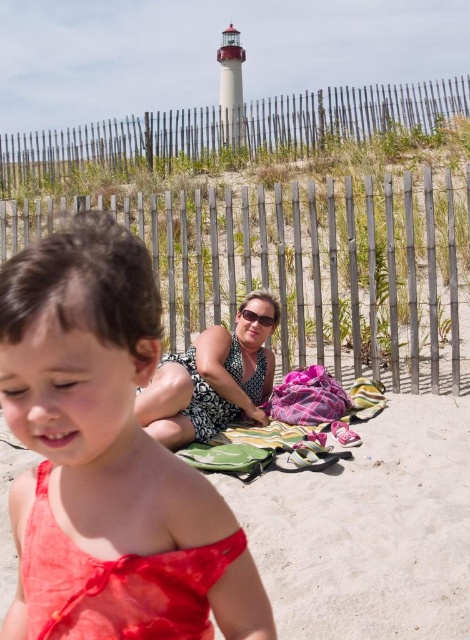
Question: Is matte red bikini top at lower left smaller than striped cotton blanket at center?

Choices:
 (A) yes
 (B) no

Answer: (A)

Question: Which point is farther to the camera?

Choices:
 (A) matte coral dress at center
 (B) matte red bikini top at lower left
 (C) matte black dress at center
 (D) striped cotton blanket at center

Answer: (C)

Question: Is matte red bikini top at lower left to the right of matte black dress at center from the viewer's perspective?

Choices:
 (A) yes
 (B) no

Answer: (A)

Question: Which point is farther to the camera?

Choices:
 (A) matte red bikini top at lower left
 (B) matte black dress at center
 (C) matte coral dress at center
 (D) striped cotton blanket at center

Answer: (B)

Question: Can you confirm if matte coral dress at center is positioned below matte black dress at center?

Choices:
 (A) no
 (B) yes

Answer: (A)

Question: Which of the following is the farthest from the observer?

Choices:
 (A) tap(153, 404)
 (B) tap(353, 419)

Answer: (B)